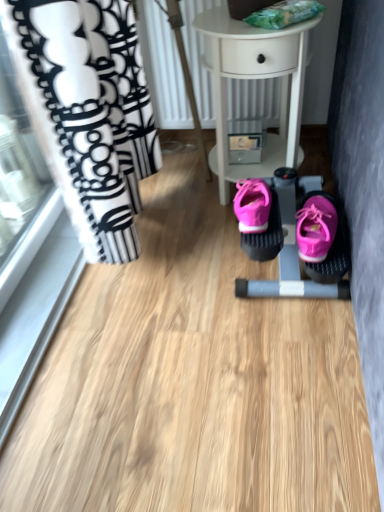
The width and height of the screenshot is (384, 512). In order to click on vacant space in front of pink fabric baby carriage at center in this screenshot , I will do `click(282, 345)`.